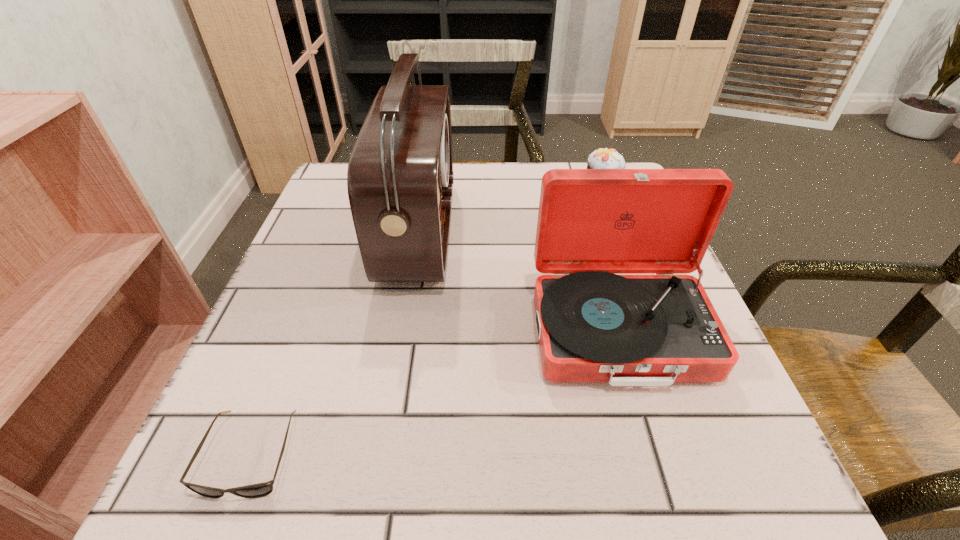
The width and height of the screenshot is (960, 540). I want to click on cupcake that is at the far edge, so click(601, 158).

Locate an element on the screen. object at the near edge is located at coordinates (258, 490).

Find the location of `object situated at the left edge`. object situated at the left edge is located at coordinates (258, 490).

Locate an element on the screen. phonograph_record located at the right edge is located at coordinates (593, 325).

Where is `cupcake at the right edge`? cupcake at the right edge is located at coordinates (601, 158).

Locate an element on the screen. object that is at the near left corner is located at coordinates (258, 490).

Image resolution: width=960 pixels, height=540 pixels. Find the location of `object located at the far right corner`. object located at the far right corner is located at coordinates (601, 158).

Where is `blank space at the far edge of the desktop`? This screenshot has height=540, width=960. blank space at the far edge of the desktop is located at coordinates (488, 184).

Image resolution: width=960 pixels, height=540 pixels. Identify the location of free region at the left edge of the desktop. (316, 266).

In the image, there is a desktop. In order to click on free space at the right edge in this screenshot , I will do `click(644, 422)`.